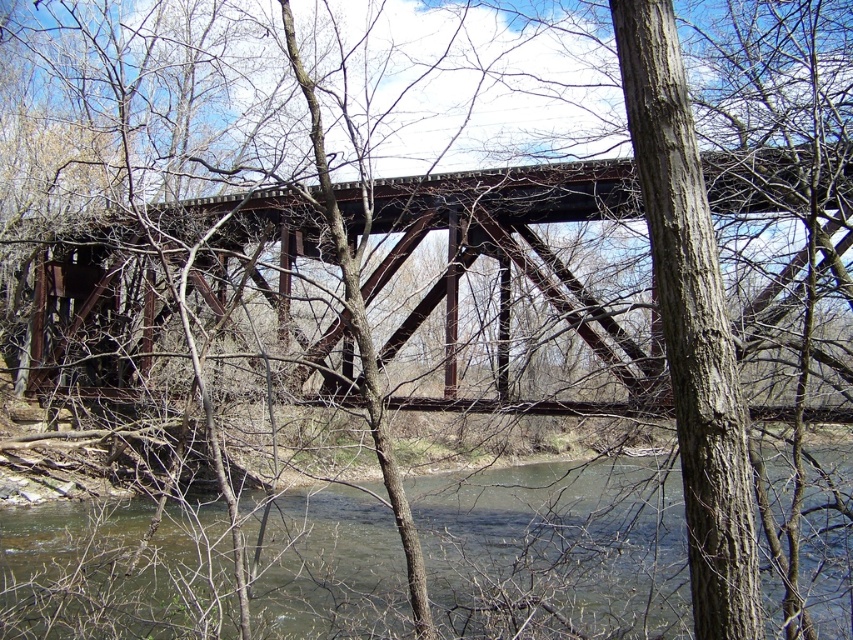
You are standing on the metal truss bridge and looking down at the water. There is a point labeled as point (556, 552). Where is this point located in relation to the greenish brown water at lower center?

The point (556, 552) is located on the greenish brown water at lower center.

From the picture: You are standing on the metal truss bridge and want to determine which of the two points, point (538, 524) or point (77, 312), is nearer to you. Based on the scene, which point is closer?

Point (538, 524) is closer to the viewer than point (77, 312).